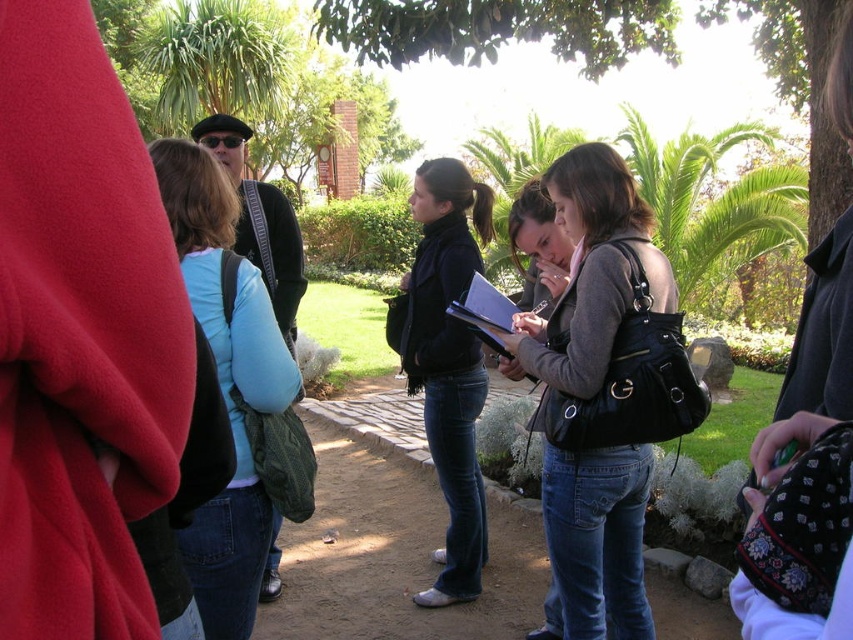
Consider the image. Does matte black purse at center appear over black matte scarf at center?

Incorrect, matte black purse at center is not positioned above black matte scarf at center.

The image size is (853, 640). I want to click on matte black purse at center, so click(x=590, y=275).

Which is behind, point (560, 314) or point (474, 385)?

The point (474, 385) is behind.

Locate an element on the screen. The height and width of the screenshot is (640, 853). matte black purse at center is located at coordinates click(x=590, y=275).

Measure the distance from matte black purse at center to light blue sweater at center.

matte black purse at center and light blue sweater at center are 1.11 meters apart.

Does point (566, 627) lie in front of point (241, 323)?

No, (566, 627) is further to viewer.

Locate an element on the screen. matte black purse at center is located at coordinates (590, 275).

Is light blue sweater at center below black matte scarf at center?

Actually, light blue sweater at center is above black matte scarf at center.

Between light blue sweater at center and black matte scarf at center, which one has more height?

Standing taller between the two is black matte scarf at center.

Which is in front, point (219, 323) or point (480, 557)?

Point (219, 323) is in front.

In order to click on light blue sweater at center in this screenshot , I will do `click(225, 385)`.